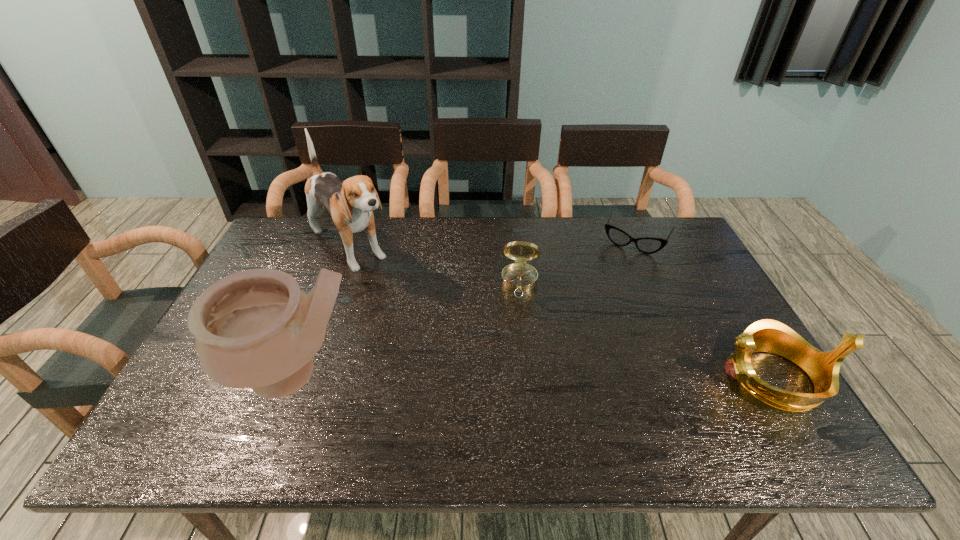
Find the location of a particular element. vacant point located at the face of the puppy is located at coordinates (422, 319).

Find the location of a particular element. The image size is (960, 540). vacant space located at the face of the puppy is located at coordinates (408, 306).

Locate an element on the screen. This screenshot has width=960, height=540. free point located with the dial facing the third object from left to right is located at coordinates (516, 384).

Find the location of `vacant point located 0.140m with the dial facing the third object from left to right`. vacant point located 0.140m with the dial facing the third object from left to right is located at coordinates (517, 334).

Where is `vacant space located 0.370m with the dial facing the third object from left to right`? This screenshot has width=960, height=540. vacant space located 0.370m with the dial facing the third object from left to right is located at coordinates (514, 409).

Image resolution: width=960 pixels, height=540 pixels. In order to click on vacant space located on the front-facing side of the shortest object in this screenshot , I will do 606,300.

At what (x,y) coordinates should I click in order to perform the action: click on vacant space situated 0.210m on the front-facing side of the shortest object. Please return your answer as a coordinate pair (x, y). Looking at the image, I should click on (608, 296).

The height and width of the screenshot is (540, 960). What are the coordinates of `vacant area located 0.230m on the front-facing side of the shortest object` in the screenshot? It's located at (606, 300).

Find the location of a particular element. This screenshot has height=540, width=960. puppy that is at the far edge is located at coordinates (351, 202).

Locate an element on the screen. Image resolution: width=960 pixels, height=540 pixels. spectacles present at the far edge is located at coordinates (648, 245).